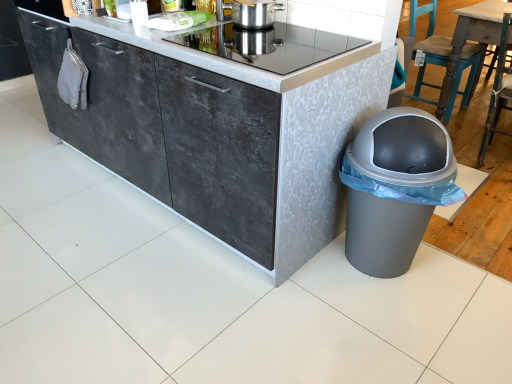
Image resolution: width=512 pixels, height=384 pixels. In order to click on free space in front of gray plastic trash can at lower right in this screenshot , I will do `click(398, 332)`.